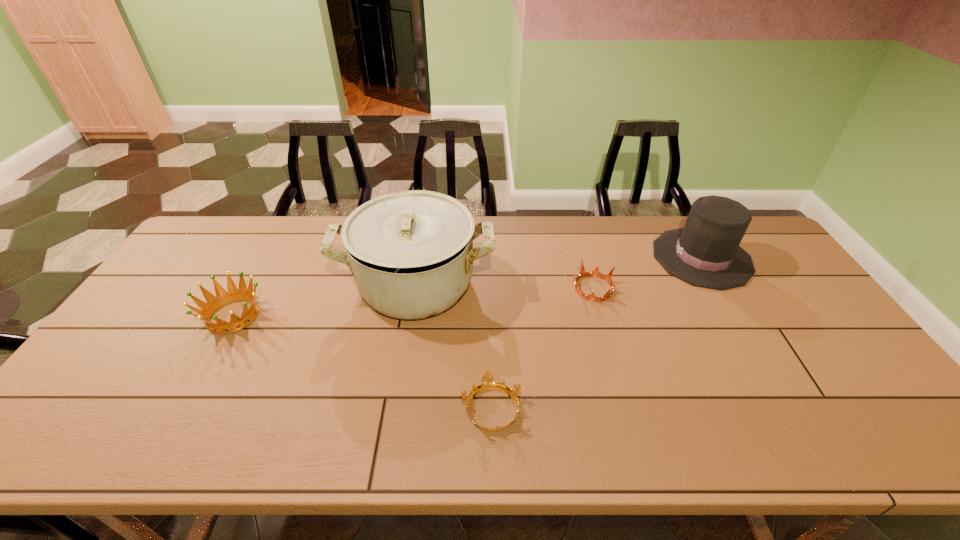
This screenshot has width=960, height=540. Identify the location of empty location between the nearest object and the saucepan. (454, 347).

Image resolution: width=960 pixels, height=540 pixels. What are the coordinates of `vacant area that lies between the saucepan and the dress hat` in the screenshot? It's located at (559, 272).

Identify which object is the nearest to the nearest object. Please provide its 2D coordinates. Your answer should be formatted as a tuple, i.e. [(x, y)], where the tuple contains the x and y coordinates of a point satisfying the conditions above.

[(411, 253)]

Select which object is the closest to the fourth object from left to right. Please provide its 2D coordinates. Your answer should be formatted as a tuple, i.e. [(x, y)], where the tuple contains the x and y coordinates of a point satisfying the conditions above.

[(706, 253)]

Identify the location of the second closest crown relative to the tallest crown. (608, 278).

Find the location of a particular element. crown that is the closest to the rightmost crown is located at coordinates (488, 384).

This screenshot has width=960, height=540. Find the location of `vacant space that satisfies the following two spatial constraints: 1. on the back side of the nearest object; 2. on the right side of the fourth object from left to right`. vacant space that satisfies the following two spatial constraints: 1. on the back side of the nearest object; 2. on the right side of the fourth object from left to right is located at coordinates (489, 288).